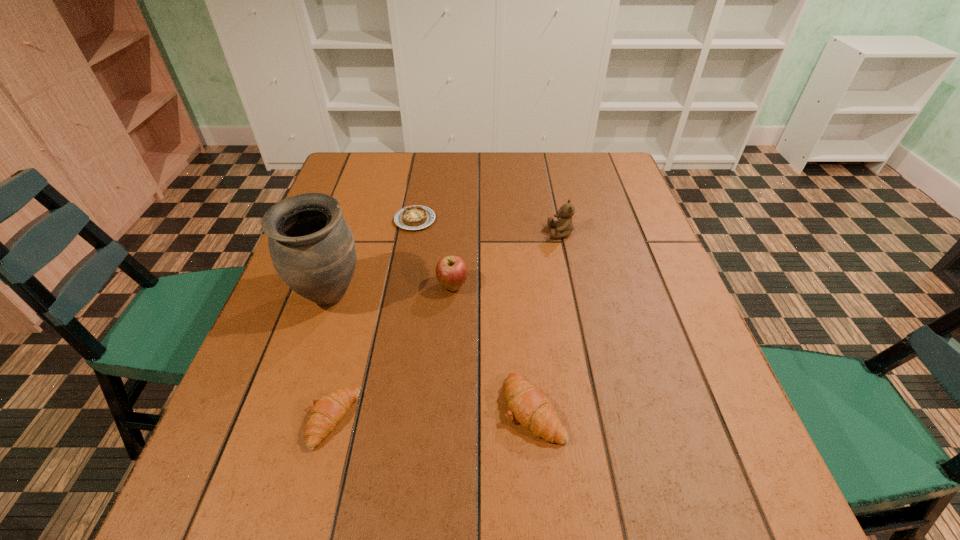
Please show where to add a crescent roll on the right while keeping spacing even. Please provide its 2D coordinates. Your answer should be formatted as a tuple, i.e. [(x, y)], where the tuple contains the x and y coordinates of a point satisfying the conditions above.

[(727, 399)]